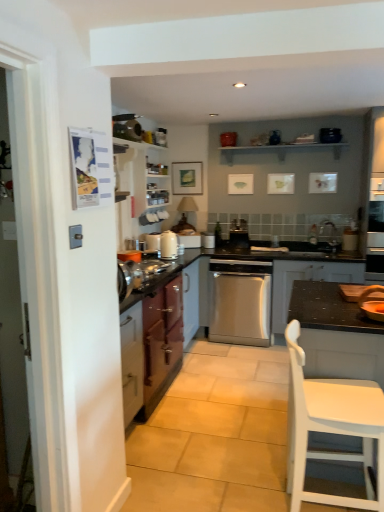
Question: Is satin silver dishwasher at center, marked as the 3th appliance in a front-to-back arrangement, looking in the opposite direction of wooden bowl at right, which ranks as the 1th appliance in front-to-back order?

Choices:
 (A) yes
 (B) no

Answer: (B)

Question: Is satin silver dishwasher at center, acting as the first appliance starting from the back, far from wooden bowl at right, which ranks as the 1th appliance in front-to-back order?

Choices:
 (A) yes
 (B) no

Answer: (A)

Question: Is satin silver dishwasher at center, placed as the second appliance when sorted from top to bottom, at the left side of wooden bowl at right, acting as the 3th appliance starting from the top?

Choices:
 (A) no
 (B) yes

Answer: (B)

Question: Does satin silver dishwasher at center, the 1th appliance in the left-to-right sequence, lie in front of wooden bowl at right, which is the 1th appliance in right-to-left order?

Choices:
 (A) yes
 (B) no

Answer: (B)

Question: Considering the relative sizes of satin silver dishwasher at center, acting as the 3th appliance starting from the right, and wooden bowl at right, which appears as the first appliance when ordered from the bottom, in the image provided, is satin silver dishwasher at center, acting as the 3th appliance starting from the right, taller than wooden bowl at right, which appears as the first appliance when ordered from the bottom,?

Choices:
 (A) yes
 (B) no

Answer: (A)

Question: Is white wooden shelf at upper center inside the boundaries of satin stainless steel dishwasher at center, or outside?

Choices:
 (A) inside
 (B) outside

Answer: (B)

Question: From the image's perspective, is white wooden shelf at upper center located above or below satin stainless steel dishwasher at center?

Choices:
 (A) below
 (B) above

Answer: (B)

Question: In terms of size, does white wooden shelf at upper center appear bigger or smaller than satin stainless steel dishwasher at center?

Choices:
 (A) big
 (B) small

Answer: (B)

Question: In terms of height, does white wooden shelf at upper center look taller or shorter compared to satin stainless steel dishwasher at center?

Choices:
 (A) tall
 (B) short

Answer: (B)

Question: From a real-world perspective, is satin stainless steel dishwasher at center above or below wooden bowl at right, which appears as the first appliance when ordered from the bottom?

Choices:
 (A) below
 (B) above

Answer: (A)

Question: Is satin stainless steel dishwasher at center inside or outside of wooden bowl at right, which is the 1th appliance in right-to-left order?

Choices:
 (A) inside
 (B) outside

Answer: (B)

Question: Looking at the image, does satin stainless steel dishwasher at center seem bigger or smaller compared to wooden bowl at right, which is the 1th appliance in right-to-left order?

Choices:
 (A) big
 (B) small

Answer: (A)

Question: Looking at their shapes, would you say satin stainless steel dishwasher at center is wider or thinner than wooden bowl at right, which ranks as the 1th appliance in front-to-back order?

Choices:
 (A) thin
 (B) wide

Answer: (B)

Question: In the image, is metallic purple cabinet at left, the 3th cabinetry viewed from the right, positioned in front of or behind dark gray matte cabinet at center, the 3th cabinetry when ordered from left to right?

Choices:
 (A) front
 (B) behind

Answer: (A)

Question: Would you say metallic purple cabinet at left, which is the 1th cabinetry from left to right, is to the left or to the right of dark gray matte cabinet at center, the 3th cabinetry when ordered from left to right, in the picture?

Choices:
 (A) left
 (B) right

Answer: (A)